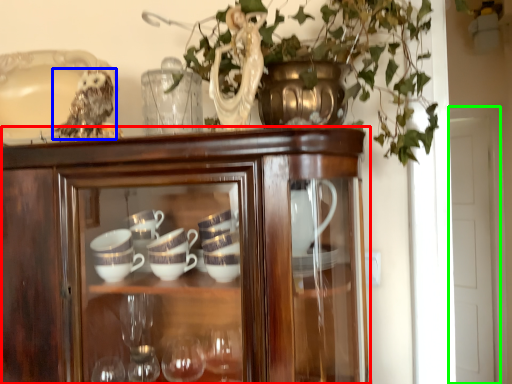
Question: Estimate the real-world distances between objects in this image. Which object is farther from cupboard (highlighted by a red box), owl (highlighted by a blue box) or glass door (highlighted by a green box)?

Choices:
 (A) owl
 (B) glass door

Answer: (B)